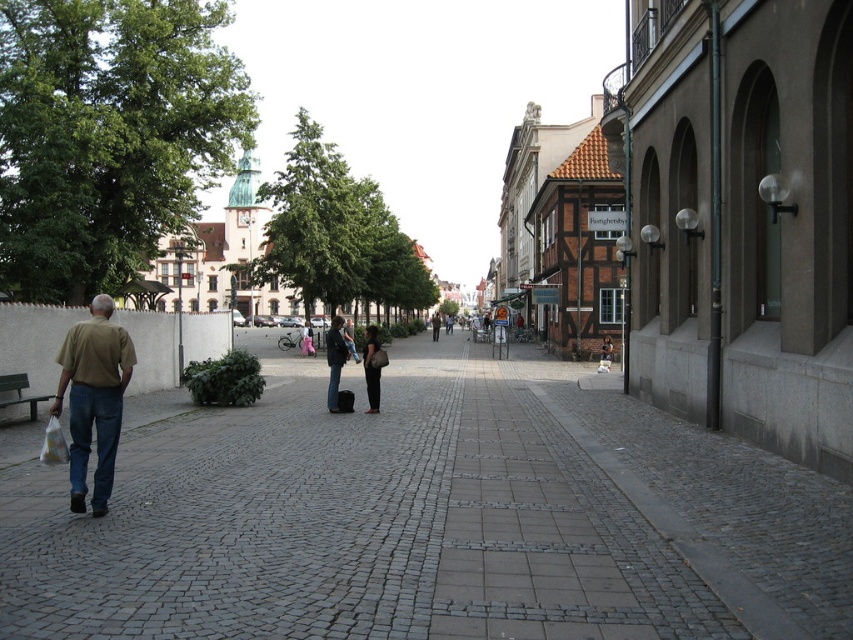
Question: Is gray cobblestone pavement at center wider than light brown shirt at center?

Choices:
 (A) no
 (B) yes

Answer: (B)

Question: Considering the real-world distances, which object is closest to the dark gray fabric bag at center?

Choices:
 (A) light brown shirt at center
 (B) matte black suitcase at center
 (C) gray cobblestone pavement at center
 (D) dark blue jeans at center

Answer: (B)

Question: Does light brown shirt at center have a greater width compared to matte black suitcase at center?

Choices:
 (A) yes
 (B) no

Answer: (B)

Question: Which object appears farthest from the camera in this image?

Choices:
 (A) dark brown leather jacket at center
 (B) light brown shirt at center
 (C) dark gray fabric bag at center
 (D) matte black suitcase at center

Answer: (A)

Question: Where is gray cobblestone pavement at center located in relation to dark gray fabric bag at center in the image?

Choices:
 (A) right
 (B) left

Answer: (A)

Question: Which point is farther to the camera?

Choices:
 (A) dark brown leather jacket at center
 (B) dark blue jeans at center
 (C) dark gray fabric bag at center
 (D) gray cobblestone pavement at center

Answer: (A)